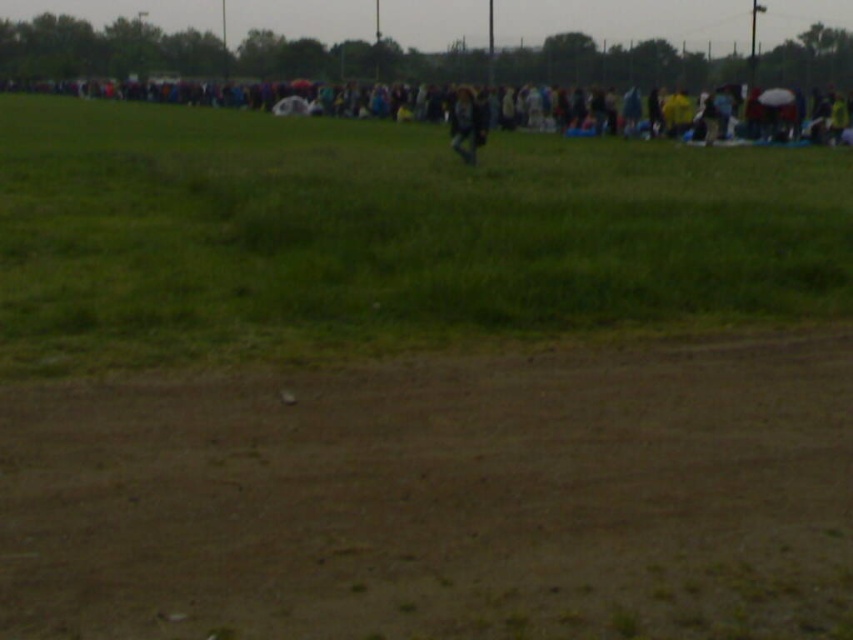
Question: Is brown dirt field at lower center smaller than dark blue jacket at center?

Choices:
 (A) yes
 (B) no

Answer: (A)

Question: Does brown dirt field at lower center appear over green grass at upper center?

Choices:
 (A) yes
 (B) no

Answer: (B)

Question: Which point is closer to the camera?

Choices:
 (A) green grass at upper center
 (B) dark blue jacket at center
 (C) brown dirt field at lower center

Answer: (C)

Question: Which of the following is the closest to the observer?

Choices:
 (A) (824, 371)
 (B) (466, 100)
 (C) (53, 147)

Answer: (A)

Question: Is brown dirt field at lower center further to camera compared to green grass at upper center?

Choices:
 (A) yes
 (B) no

Answer: (B)

Question: Which object is positioned closest to the brown dirt field at lower center?

Choices:
 (A) dark blue jacket at center
 (B) green grass at upper center

Answer: (B)